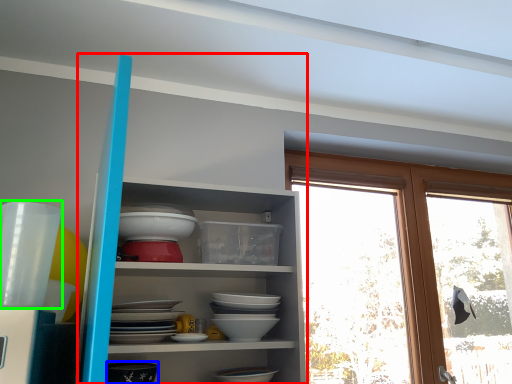
Question: Estimate the real-world distances between objects in this image. Which object is farther from shelf (highlighted by a red box), tableware (highlighted by a blue box) or tableware (highlighted by a green box)?

Choices:
 (A) tableware
 (B) tableware

Answer: (B)